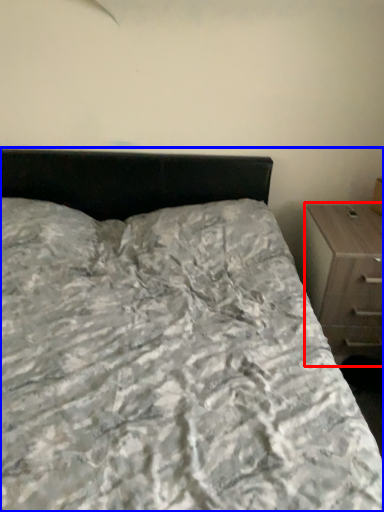
Question: Which object is further to the camera taking this photo, chest of drawers (highlighted by a red box) or bed (highlighted by a blue box)?

Choices:
 (A) chest of drawers
 (B) bed

Answer: (A)